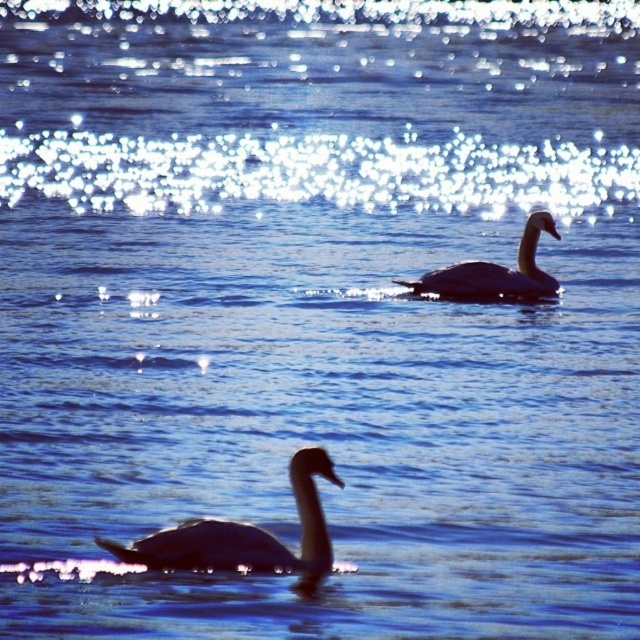
You are standing at the edge of the water and see two points on the water surface labeled as point (276, 545) and point (460, 269). Which point is closer to you?

Point (276, 545) is closer to you because it is in front of point (460, 269).

You are an ornithologist observing two swans in the water. You notice the silvery glossy swan at lower left and the gray matte swan at upper right. Which swan takes up more space in the image?

The gray matte swan at upper right takes up more space in the image since the silvery glossy swan at lower left occupies less space than it.